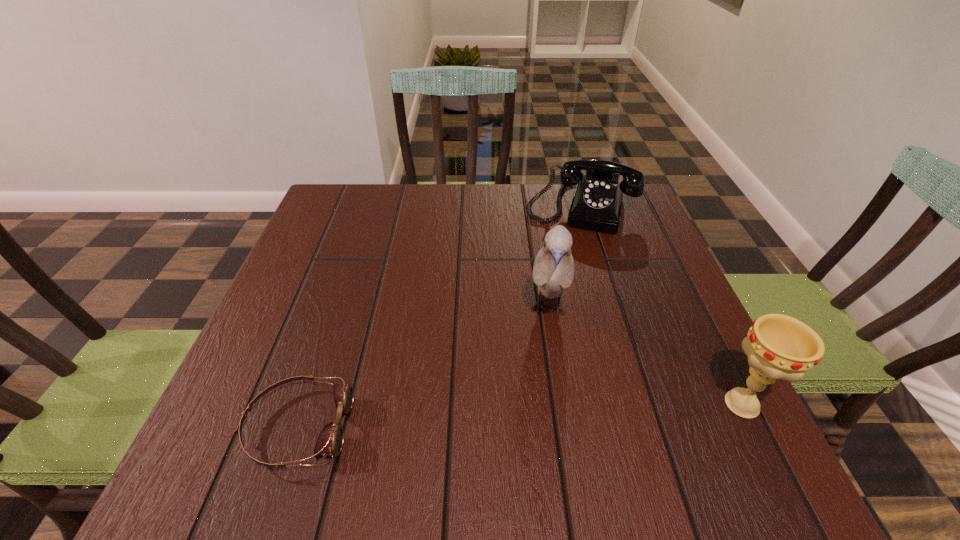
Locate an element on the screen. blank area in the image that satisfies the following two spatial constraints: 1. on the front side of the tallest object; 2. on the right side of the second tallest object is located at coordinates (562, 404).

This screenshot has width=960, height=540. Identify the location of free space that satisfies the following two spatial constraints: 1. on the front side of the bird; 2. on the right side of the chalice. (562, 404).